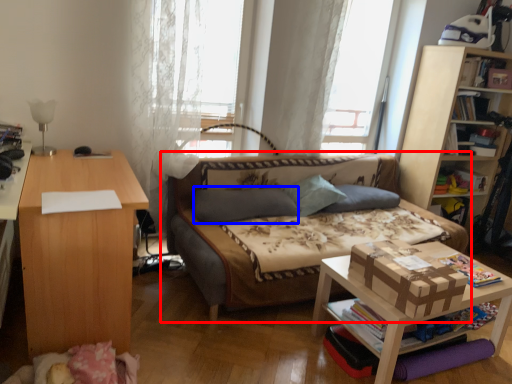
Question: Among these objects, which one is farthest to the camera, studio couch (highlighted by a red box) or pillow (highlighted by a blue box)?

Choices:
 (A) studio couch
 (B) pillow

Answer: (B)